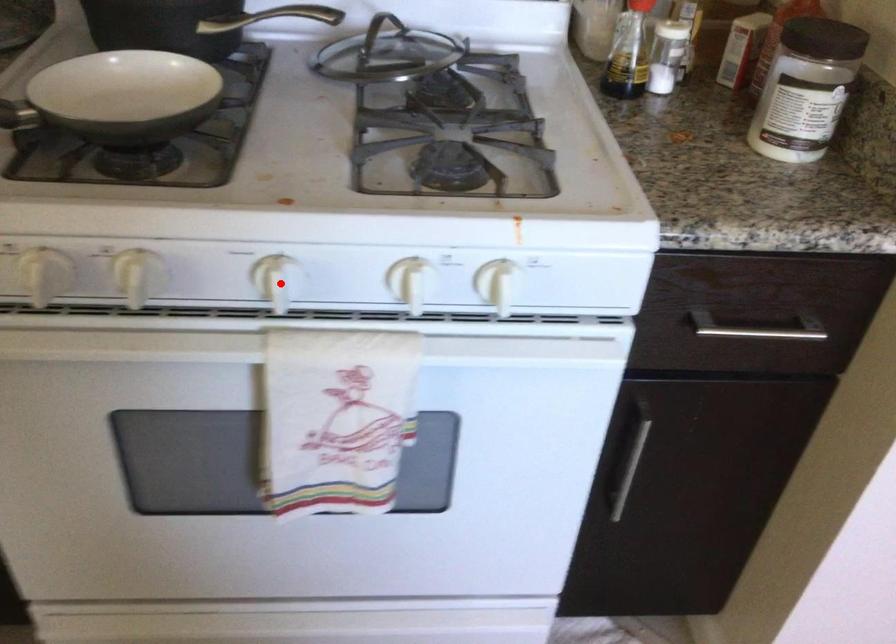
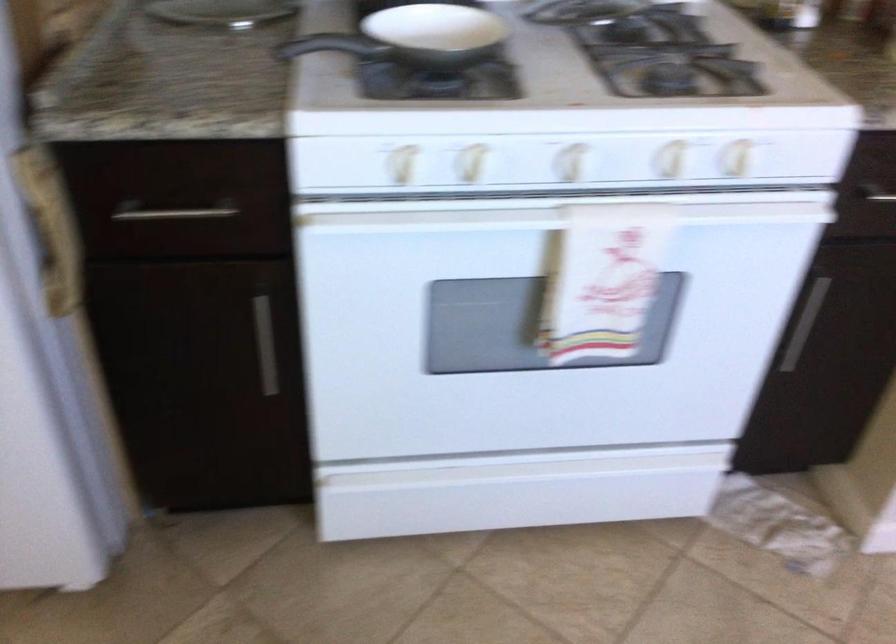
Question: I am providing you with two images of the same scene from different viewpoints. Image1 has a red point marked. In image2, the corresponding 3D location appears at what relative position? Reply with the corresponding letter.

Choices:
 (A) Closer
 (B) Farther

Answer: (B)